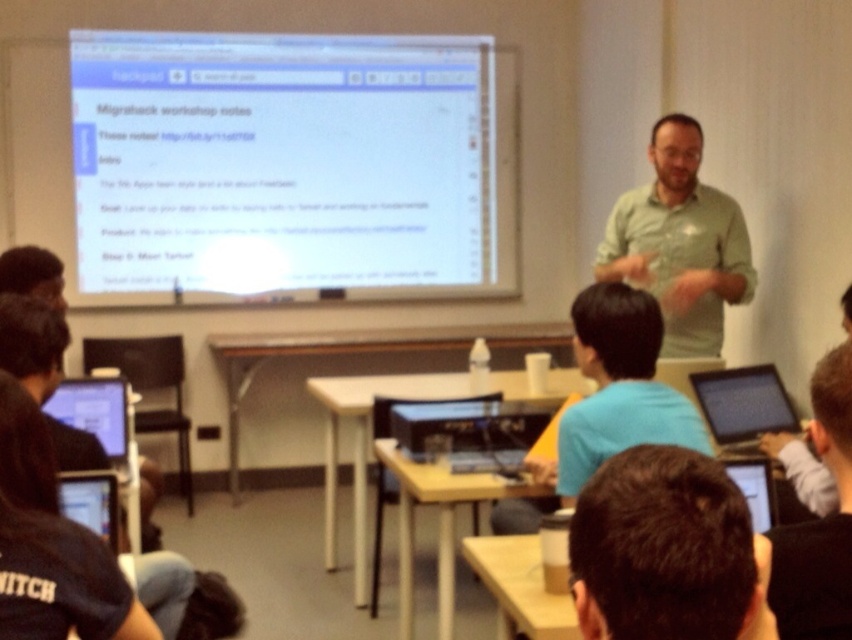
Can you confirm if green matte shirt at center is smaller than light blue shirt at upper right?

Incorrect, green matte shirt at center is not smaller in size than light blue shirt at upper right.

Identify the location of green matte shirt at center. This screenshot has width=852, height=640. (678, 243).

Locate an element on the screen. green matte shirt at center is located at coordinates (678, 243).

Can you confirm if white matte screen at upper center is thinner than light blue shirt at upper right?

No.

Which of these two, white matte screen at upper center or light blue shirt at upper right, stands taller?

white matte screen at upper center

You are a GUI agent. You are given a task and a screenshot of the screen. Output one action in this format:
    pyautogui.click(x=<x>, y=<y>)
    Task: Click on the white matte screen at upper center
    This screenshot has height=640, width=852.
    Given the screenshot: What is the action you would take?
    pyautogui.click(x=281, y=164)

Which is more to the right, light blue shirt at upper right or black glossy laptop at lower right?

Result: black glossy laptop at lower right

Who is more distant from viewer, (796, 552) or (753, 436)?

Point (753, 436)

Is point (832, 580) in front of point (766, 426)?

Yes.

At what (x,y) coordinates should I click in order to perform the action: click on light blue shirt at upper right. Please return your answer as a coordinate pair (x, y). This screenshot has width=852, height=640. Looking at the image, I should click on (819, 522).